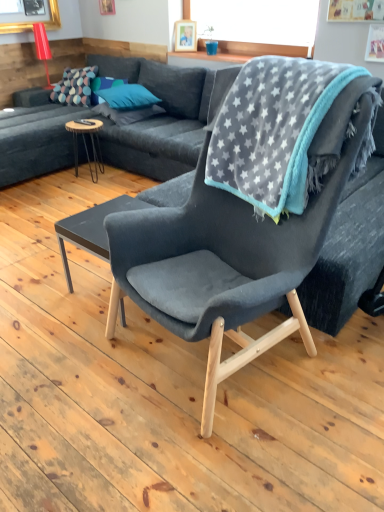
Question: Should I look upward or downward to see matte red lampshade at upper left?

Choices:
 (A) down
 (B) up

Answer: (B)

Question: Are dark gray matte coffee table at center, which ranks as the 2th coffee table in back-to-front order, and gray star-patterned blanket at upper right located far from each other?

Choices:
 (A) yes
 (B) no

Answer: (B)

Question: Could you tell me if dark gray matte coffee table at center, the 1th coffee table when ordered from front to back, is turned towards gray star-patterned blanket at upper right?

Choices:
 (A) no
 (B) yes

Answer: (A)

Question: Is dark gray matte coffee table at center, the 1th coffee table positioned from the right, in front of gray star-patterned blanket at upper right?

Choices:
 (A) yes
 (B) no

Answer: (B)

Question: From a real-world perspective, is dark gray matte coffee table at center, acting as the 1th coffee table starting from the bottom, positioned under gray star-patterned blanket at upper right based on gravity?

Choices:
 (A) no
 (B) yes

Answer: (B)

Question: From the image's perspective, is dark gray matte coffee table at center, the 1th coffee table when ordered from front to back, beneath gray star-patterned blanket at upper right?

Choices:
 (A) no
 (B) yes

Answer: (B)

Question: Is dark gray matte coffee table at center, acting as the second coffee table starting from the left, looking in the opposite direction of gray star-patterned blanket at upper right?

Choices:
 (A) no
 (B) yes

Answer: (A)

Question: Is wooden picture frame at upper center facing away from teal fabric pillow at center, the second pillow viewed from the right?

Choices:
 (A) no
 (B) yes

Answer: (A)

Question: Is wooden picture frame at upper center behind teal fabric pillow at center, the second pillow viewed from the right?

Choices:
 (A) no
 (B) yes

Answer: (A)

Question: Is wooden picture frame at upper center outside of teal fabric pillow at center, the 2th pillow from the left?

Choices:
 (A) yes
 (B) no

Answer: (A)

Question: Considering the relative sizes of wooden picture frame at upper center and teal fabric pillow at center, the second pillow viewed from the right, in the image provided, is wooden picture frame at upper center bigger than teal fabric pillow at center, the second pillow viewed from the right,?

Choices:
 (A) yes
 (B) no

Answer: (B)

Question: From the image's perspective, is wooden picture frame at upper center beneath teal fabric pillow at center, the 2th pillow from the left?

Choices:
 (A) no
 (B) yes

Answer: (A)

Question: Considering the relative positions of wooden picture frame at upper center and teal fabric pillow at center, the second pillow viewed from the right, in the image provided, is wooden picture frame at upper center to the left of teal fabric pillow at center, the second pillow viewed from the right, from the viewer's perspective?

Choices:
 (A) no
 (B) yes

Answer: (A)

Question: Is multicolored dotted fabric pillow at upper left, which is counted as the 3th pillow, starting from the right, shorter than gray star-patterned blanket at upper right?

Choices:
 (A) no
 (B) yes

Answer: (B)